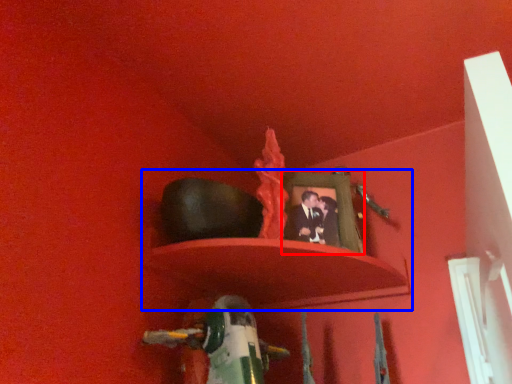
Question: Among these objects, which one is farthest to the camera, picture frame (highlighted by a red box) or shelf (highlighted by a blue box)?

Choices:
 (A) picture frame
 (B) shelf

Answer: (A)